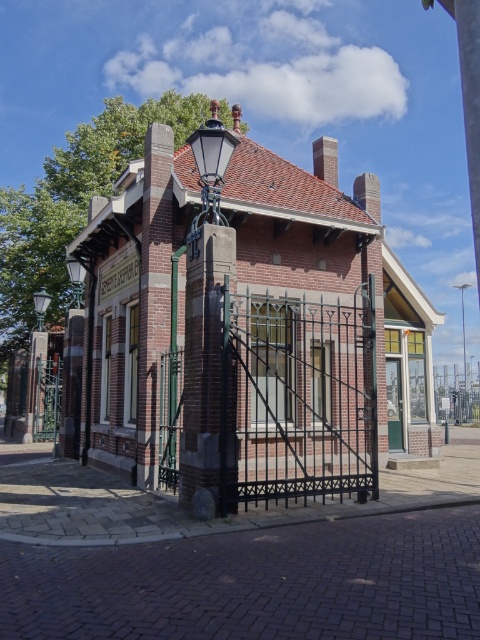
You are standing in front of the brick building and notice two points marked on the facade. The first point is at coordinate (80, 280) and the second is at (464, 314). Which point is closer to you?

Point (80, 280) is closer to the viewer than point (464, 314).

You are a city planner evaluating the lighting setup outside the Gemeente Geverifieerd building. You need to determine if the matte black lamp at left can be replaced with a larger model to match the scale of the metallic silver streetlamp at center. Based on their sizes, is this feasible?

The matte black lamp at left is smaller than the metallic silver streetlamp at center, so replacing it with a larger model would make them more proportionate in size.